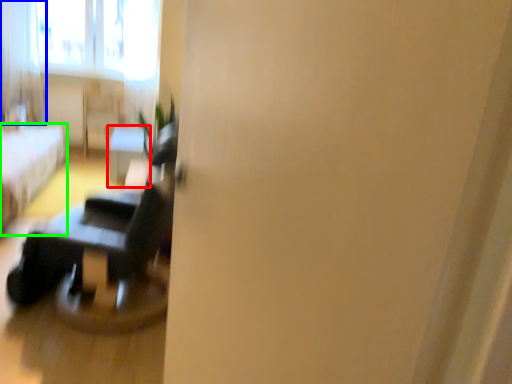
Question: Based on their relative distances, which object is farther from table (highlighted by a red box)? Choose from curtain (highlighted by a blue box) and furniture (highlighted by a green box).

Choices:
 (A) curtain
 (B) furniture

Answer: (A)